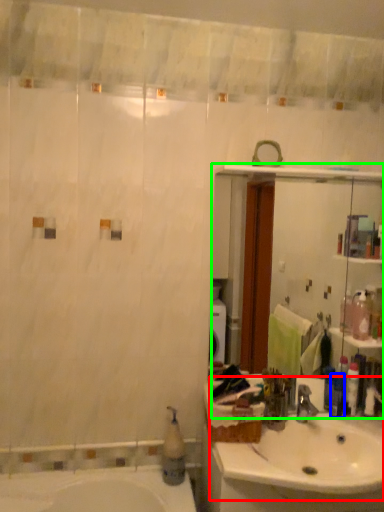
Question: Which object is positioned farthest from sink (highlighted by a red box)? Select from toiletry (highlighted by a blue box) and mirror (highlighted by a green box).

Choices:
 (A) toiletry
 (B) mirror

Answer: (B)